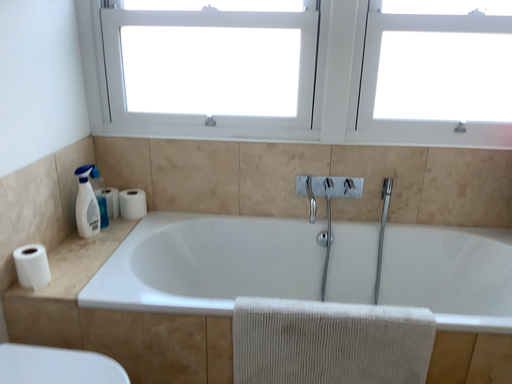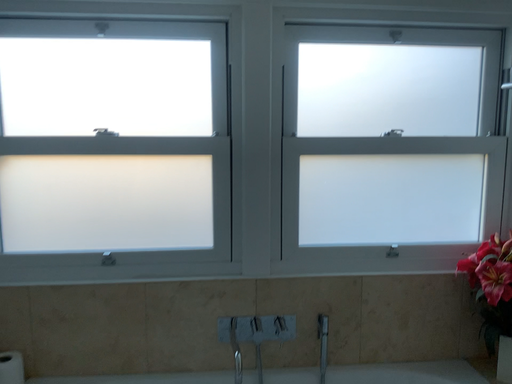
Question: Which way did the camera rotate in the video?

Choices:
 (A) rotated upward
 (B) rotated downward

Answer: (A)